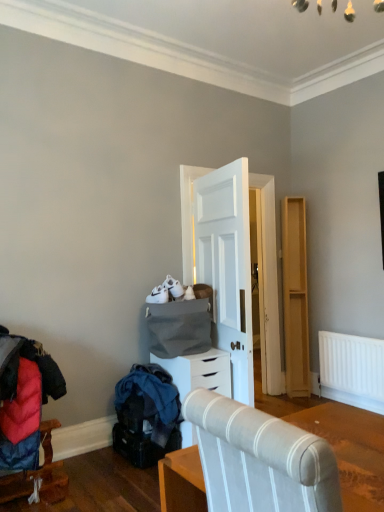
The width and height of the screenshot is (384, 512). What are the coordinates of `empty space that is to the right of velvet red coat at lower left, acting as the 1th furniture starting from the bottom` in the screenshot? It's located at (105, 487).